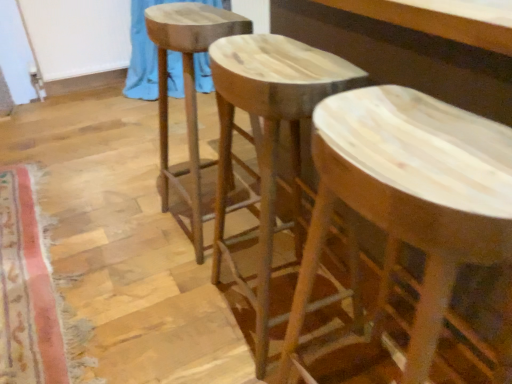
Question: Do you think blue fabric at upper left is within natural wood stool at center, the 2th stool positioned from the right, or outside of it?

Choices:
 (A) inside
 (B) outside

Answer: (B)

Question: From a real-world perspective, relative to natural wood stool at center, the 2th stool positioned from the right, is blue fabric at upper left vertically above or below?

Choices:
 (A) above
 (B) below

Answer: (B)

Question: Considering the real-world distances, which object is closest to the natural wood stool at center, arranged as the 1th stool when viewed from the right?

Choices:
 (A) blue fabric at upper left
 (B) natural wood stool at center, which is the 1th stool in left-to-right order
 (C) natural wood stool at center, the 2th stool positioned from the right
 (D) carpeted mat at lower left

Answer: (C)

Question: Which object is positioned closest to the carpeted mat at lower left?

Choices:
 (A) natural wood stool at center, the 2th stool positioned from the right
 (B) natural wood stool at center, arranged as the 1th stool when viewed from the right
 (C) blue fabric at upper left
 (D) natural wood stool at center, which is the 1th stool in left-to-right order

Answer: (D)